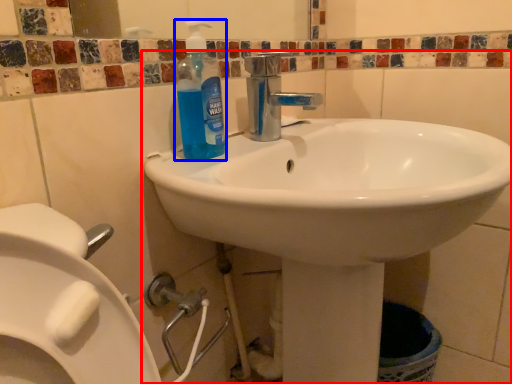
Question: Which object is further to the camera taking this photo, sink (highlighted by a red box) or cleaning product (highlighted by a blue box)?

Choices:
 (A) sink
 (B) cleaning product

Answer: (B)